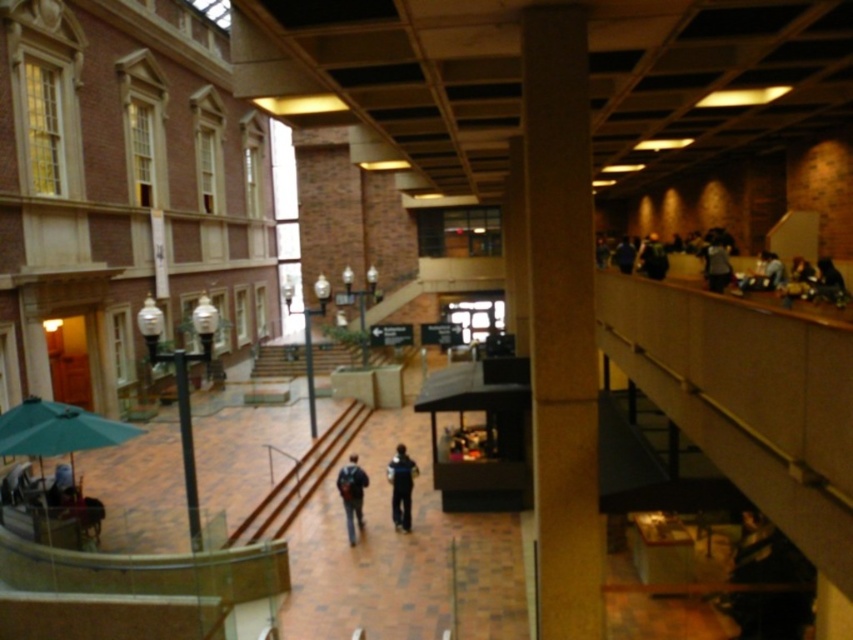
You are standing in the atrium and want to take a photo of the brown textured pillar at center without any people blocking it. Since the dark blue jeans at center are part of a person walking by, will the pillar be visible in the photo if you aim directly at it?

The brown textured pillar at center has a lesser height compared to dark blue jeans at center, so the pillar will be visible in the photo as it is shorter than the person wearing the dark blue jeans at center.